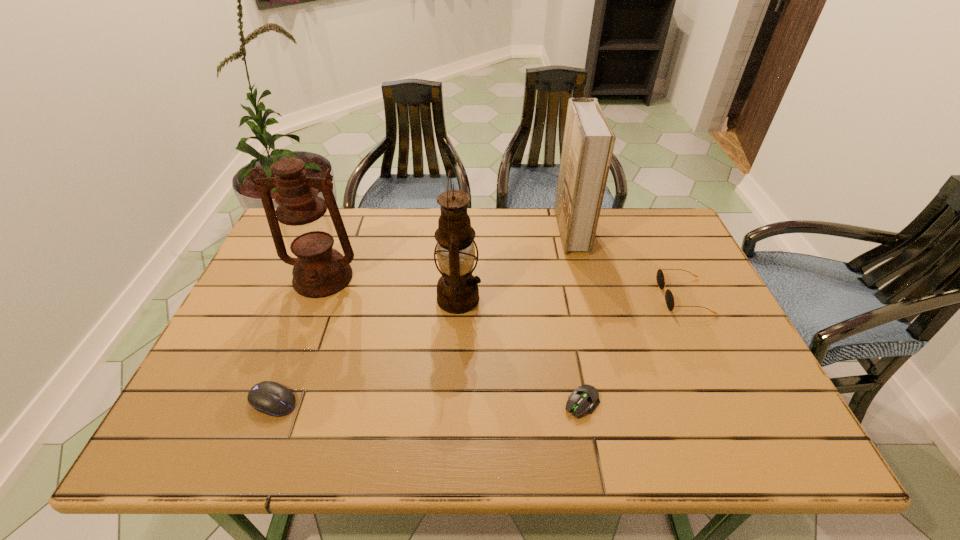
At what (x,y) coordinates should I click in order to perform the action: click on free point located on the cover of the phonebook. Please return your answer as a coordinate pair (x, y). Looking at the image, I should click on (542, 230).

Locate an element on the screen. free space located 0.110m on the cover of the phonebook is located at coordinates (524, 230).

This screenshot has height=540, width=960. I want to click on free region located on the right of the right oil lamp, so click(585, 299).

Identify the location of free point located on the left of the left oil lamp. (258, 278).

At what (x,y) coordinates should I click in order to perform the action: click on vacant space located 0.370m on the front-facing side of the fourth tallest object. Please return your answer as a coordinate pair (x, y). The image size is (960, 540). Looking at the image, I should click on (524, 296).

The height and width of the screenshot is (540, 960). I want to click on free region located 0.230m on the front-facing side of the fourth tallest object, so click(576, 296).

Identify the location of vacant position located 0.240m on the front-facing side of the fourth tallest object. This screenshot has width=960, height=540. coord(572,296).

Where is `vacant point located on the back of the second shortest object`? vacant point located on the back of the second shortest object is located at coordinates (320, 281).

What are the coordinates of `free point located on the right of the shortest object` in the screenshot? It's located at pos(628,403).

At what (x,y) coordinates should I click in order to perform the action: click on object that is at the far edge. Please return your answer as a coordinate pair (x, y). The height and width of the screenshot is (540, 960). Looking at the image, I should click on (588, 143).